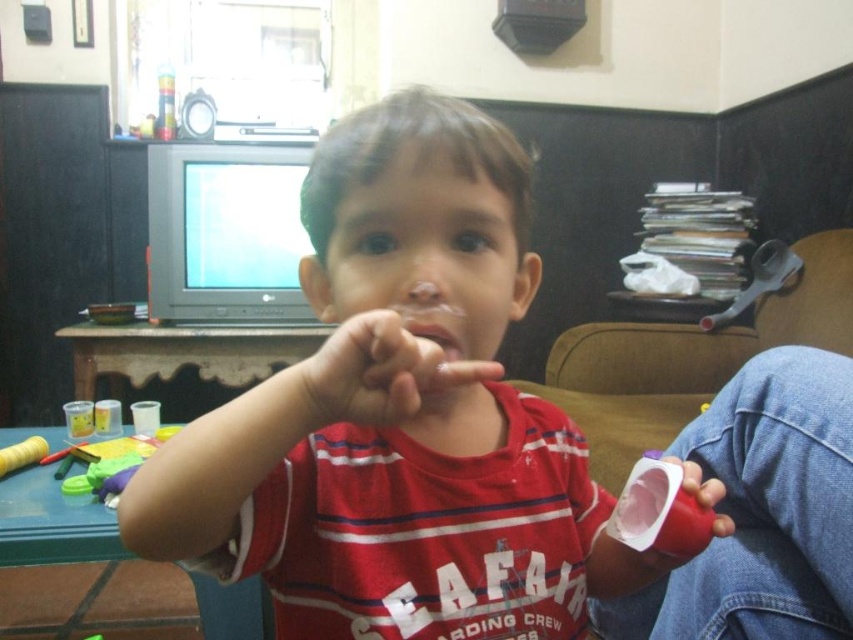
Is point (647, 464) farther from viewer compared to point (461, 353)?

That is True.

Can you confirm if pink matte cup at lower right is positioned to the left of clear plastic mouth at center?

No, pink matte cup at lower right is not to the left of clear plastic mouth at center.

Is point (680, 515) less distant than point (456, 356)?

That is False.

Identify the location of pink matte cup at lower right. The height and width of the screenshot is (640, 853). pyautogui.click(x=659, y=512).

Does red matte shirt at center have a greater height compared to pink matte cup at lower right?

Yes, red matte shirt at center is taller than pink matte cup at lower right.

Does red matte shirt at center appear over pink matte cup at lower right?

Indeed, red matte shirt at center is positioned over pink matte cup at lower right.

Where is `red matte shirt at center`? The width and height of the screenshot is (853, 640). red matte shirt at center is located at coordinates (398, 416).

Is red matte shirt at center taller than clear plastic mouth at center?

Indeed, red matte shirt at center has a greater height compared to clear plastic mouth at center.

Can you confirm if red matte shirt at center is positioned above clear plastic mouth at center?

Actually, red matte shirt at center is below clear plastic mouth at center.

Is point (310, 419) positioned after point (447, 342)?

No, (310, 419) is closer to viewer.

This screenshot has height=640, width=853. What are the coordinates of `red matte shirt at center` in the screenshot? It's located at (x=398, y=416).